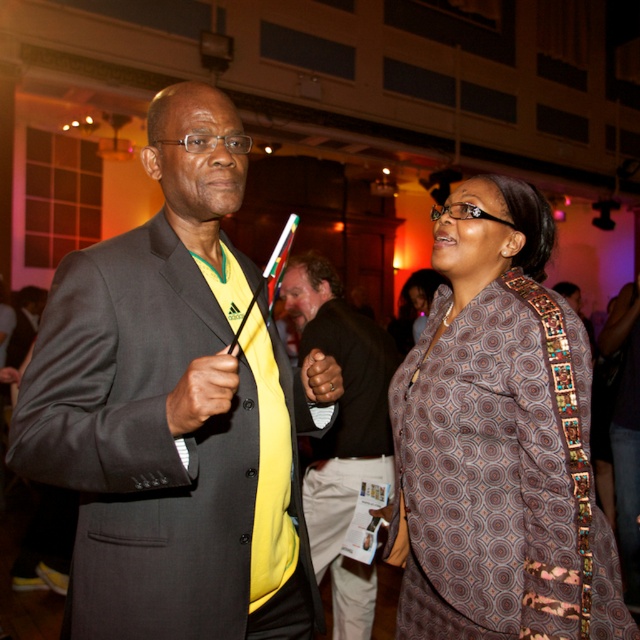
You are a photographer at the event and want to capture a photo that includes both the brown printed fabric dress at right and the yellow fabric shirt at center. Which of the two items will appear closer to the camera in the photo?

The brown printed fabric dress at right will appear closer to the camera in the photo because it is in front of the yellow fabric shirt at center according to their positions.